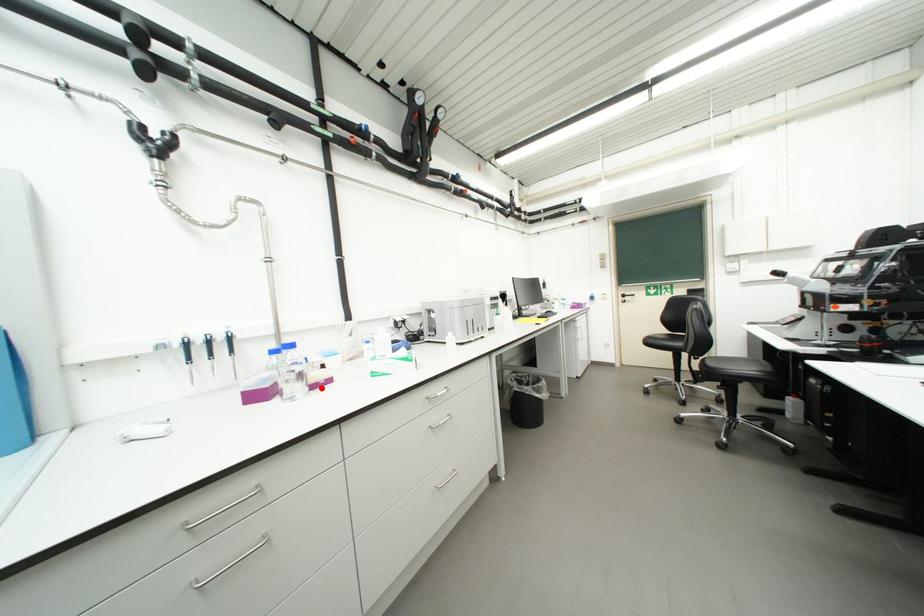
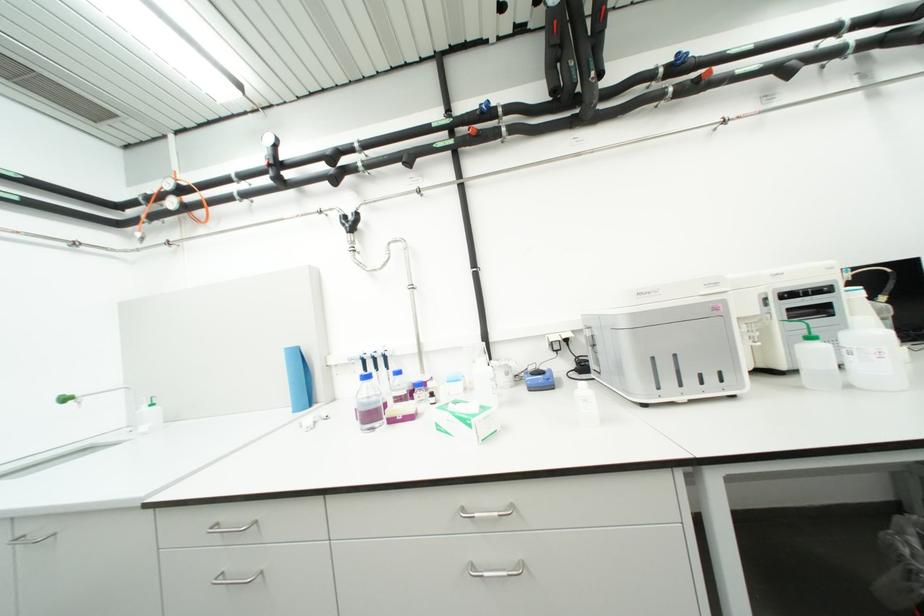
The point at the highlighted location is marked in the first image. Where is the corresponding point in the second image?

(399, 422)